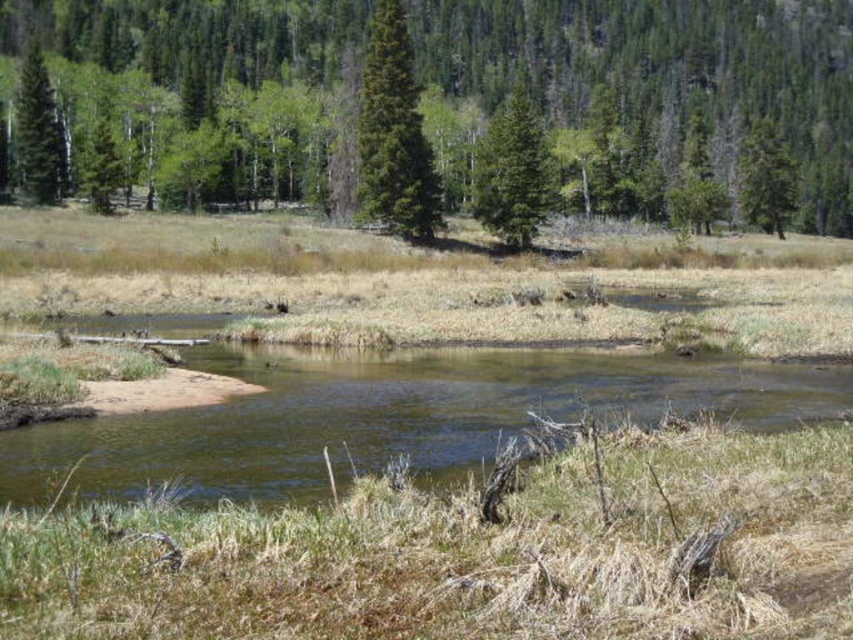
You are planning to set up a small campsite between the green matte tree at upper center and the green matte evergreen tree at center. The distance between them is crucial for your setup. Can you determine if the distance between these two trees is sufficient to accommodate a campsite that requires at least 50 meters of space?

The distance between the green matte tree at upper center and the green matte evergreen tree at center is 48.87 meters, which is slightly less than the required 50 meters. Therefore, the space is insufficient for the campsite.

You are standing at the point marked by point (393, 134) in the image, which is at the center of the scene. You want to walk towards the dense forest of coniferous trees in the background. In which direction should you head?

You should head north because the dense forest of coniferous trees in the background is located north of the point (393, 134) marked as green matte evergreen tree at center.

You are a hiker standing at the base of the green matte tree at upper center. You want to take a photo of the forest in the background. Which direction should you face to capture the dense coniferous forest?

The green matte tree at upper center is positioned at point (x=666, y=74). Facing towards the background direction from this tree would allow you to capture the dense coniferous forest in the image.